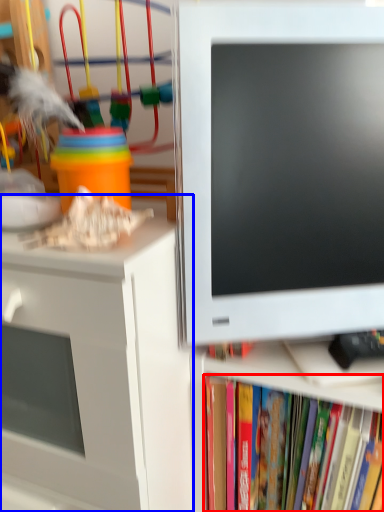
Question: Which object appears closest to the camera in this image, book (highlighted by a red box) or desk (highlighted by a blue box)?

Choices:
 (A) book
 (B) desk

Answer: (B)